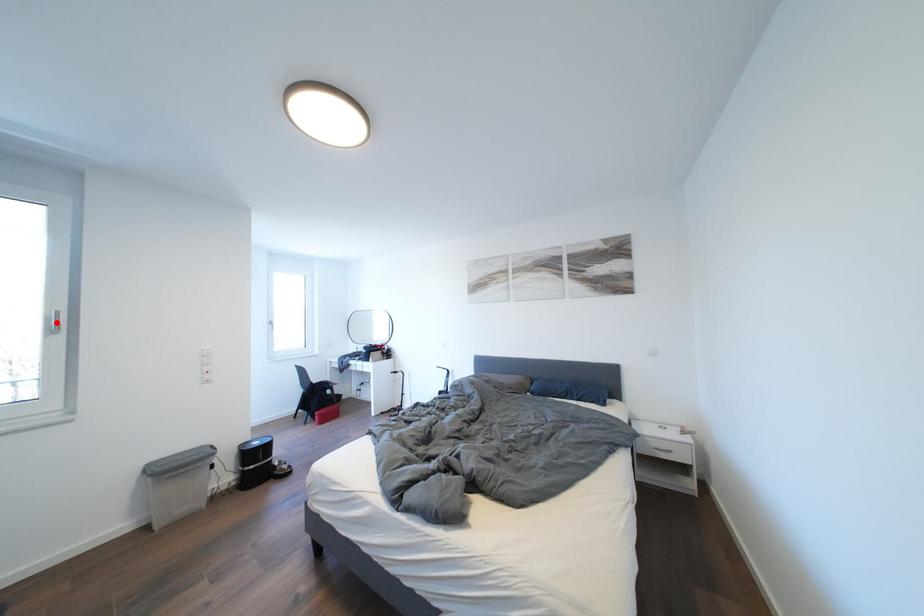
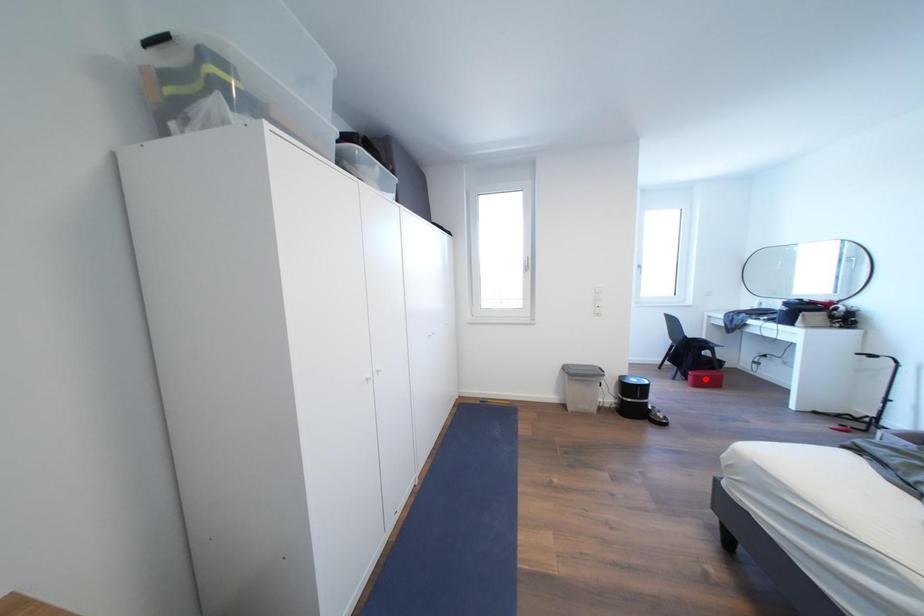
I am providing you with two images of the same scene from different viewpoints. A red point is marked on the first image and another point is marked on the second image. Do the highlighted points in image1 and image2 indicate the same real-world spot?

No